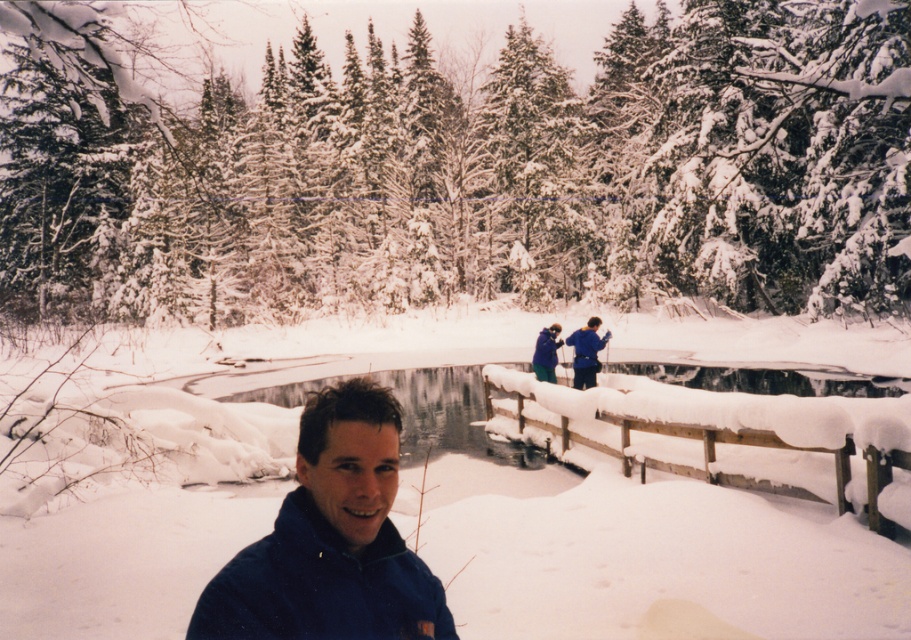
Is blue fleece jacket at lower left closer to the viewer compared to blue fleece jacket at center?

That is True.

Based on the photo, can you confirm if blue fleece jacket at lower left is smaller than blue fleece jacket at center?

Correct, blue fleece jacket at lower left occupies less space than blue fleece jacket at center.

Between point (293, 570) and point (554, 337), which one is positioned behind?

The point (554, 337) is more distant.

Locate an element on the screen. Image resolution: width=911 pixels, height=640 pixels. blue fleece jacket at lower left is located at coordinates (331, 540).

Looking at this image, how much distance is there between blue fleece jacket at upper center and blue fleece jacket at center?

A distance of 55.48 centimeters exists between blue fleece jacket at upper center and blue fleece jacket at center.

Who is more distant from viewer, (x=587, y=352) or (x=551, y=362)?

Point (x=551, y=362)

Locate an element on the screen. The height and width of the screenshot is (640, 911). blue fleece jacket at upper center is located at coordinates pos(586,353).

The image size is (911, 640). What do you see at coordinates (331, 540) in the screenshot? I see `blue fleece jacket at lower left` at bounding box center [331, 540].

Which is behind, point (357, 464) or point (584, 358)?

The point (584, 358) is behind.

What are the coordinates of `blue fleece jacket at lower left` in the screenshot? It's located at (331, 540).